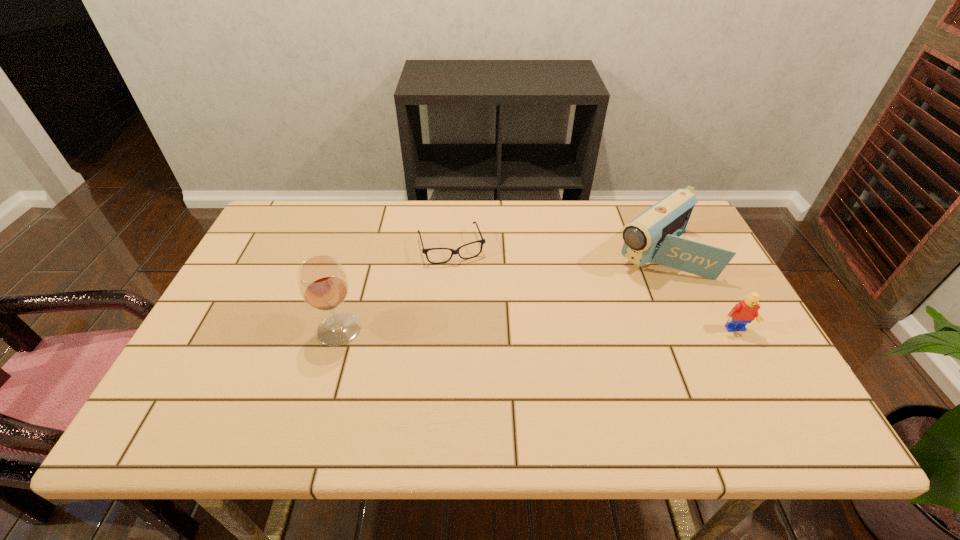
Locate an element on the screen. Image resolution: width=960 pixels, height=540 pixels. free space between the second object from left to right and the third tallest object is located at coordinates (592, 288).

In order to click on blank region between the camcorder and the leftmost object in this screenshot , I will do `click(498, 291)`.

The image size is (960, 540). I want to click on vacant space that is in between the second tallest object and the second object from left to right, so click(x=554, y=249).

At what (x,y) coordinates should I click in order to perform the action: click on vacant space in between the Lego and the third shortest object. Please return your answer as a coordinate pair (x, y). Looking at the image, I should click on (695, 291).

Locate which object ranks third in proximity to the camcorder. Please provide its 2D coordinates. Your answer should be formatted as a tuple, i.e. [(x, y)], where the tuple contains the x and y coordinates of a point satisfying the conditions above.

[(323, 284)]

Identify which object is the closest to the second shortest object. Please provide its 2D coordinates. Your answer should be formatted as a tuple, i.e. [(x, y)], where the tuple contains the x and y coordinates of a point satisfying the conditions above.

[(653, 236)]

Where is `free spot that satisfies the following two spatial constraints: 1. on the back side of the tallest object; 2. on the right side of the third shortest object`? This screenshot has width=960, height=540. free spot that satisfies the following two spatial constraints: 1. on the back side of the tallest object; 2. on the right side of the third shortest object is located at coordinates (362, 251).